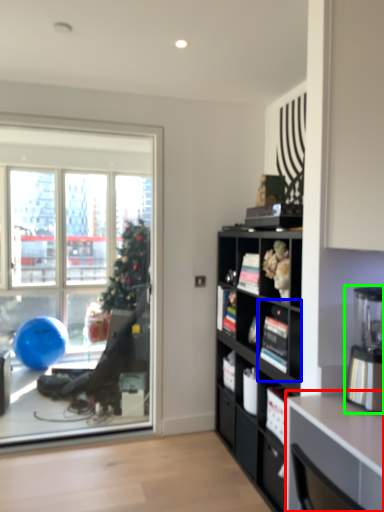
Question: Which object is positioned farthest from desk (highlighted by a red box)? Select from shelf (highlighted by a blue box) and coffee machine (highlighted by a green box).

Choices:
 (A) shelf
 (B) coffee machine

Answer: (A)